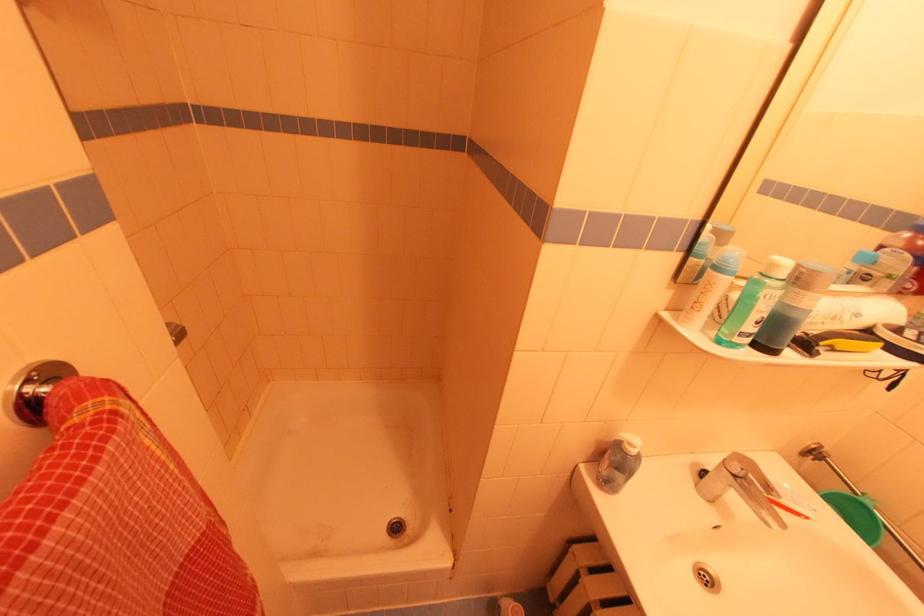
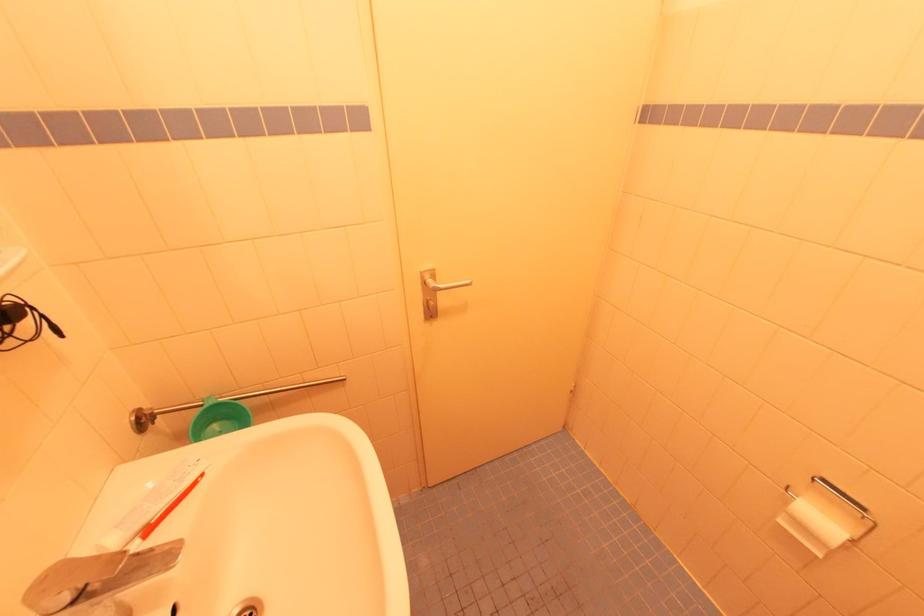
Locate, in the second image, the point that corresponds to the point at 736,472 in the first image.

(69, 602)